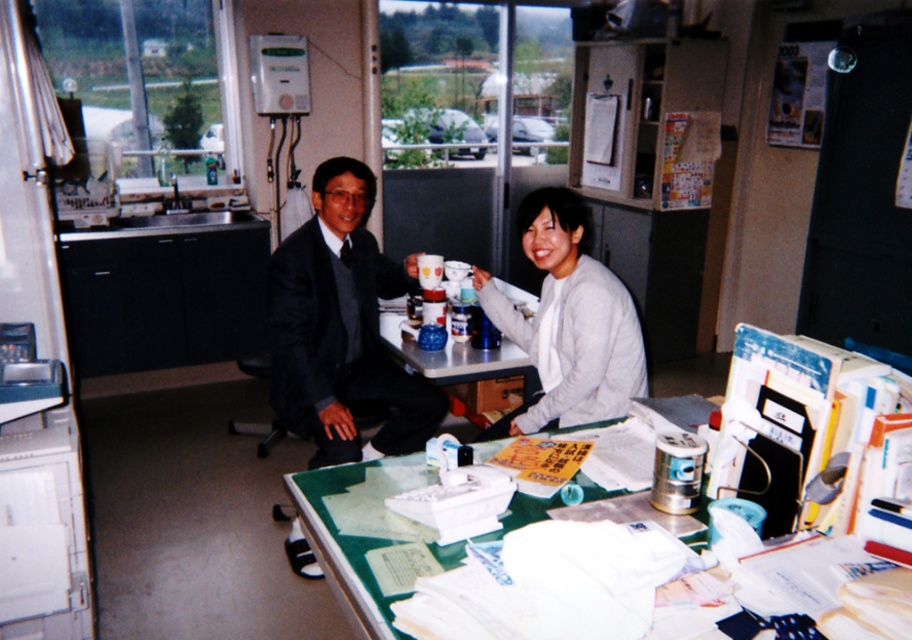
Does light gray sweater at center have a lesser height compared to green glass table at center?

Incorrect, light gray sweater at center's height does not fall short of green glass table at center's.

Consider the image. Which of these two, light gray sweater at center or green glass table at center, stands shorter?

With less height is green glass table at center.

Is point (566, 193) farther from viewer compared to point (395, 596)?

Yes, point (566, 193) is farther from viewer.

This screenshot has height=640, width=912. I want to click on light gray sweater at center, so click(x=567, y=323).

Can you confirm if matte black suit at center is taller than matte plastic table at center?

Yes.

Is matte black suit at center positioned at the back of matte plastic table at center?

That is False.

Is point (361, 312) farther from viewer compared to point (395, 339)?

No, (361, 312) is closer to viewer.

The width and height of the screenshot is (912, 640). I want to click on matte black suit at center, so click(342, 328).

This screenshot has width=912, height=640. In order to click on dark gray suit at center in this screenshot , I will do `click(342, 328)`.

Does point (358, 257) lie in front of point (338, 596)?

No.

This screenshot has width=912, height=640. In order to click on dark gray suit at center in this screenshot , I will do `click(342, 328)`.

Locate an element on the screen. Image resolution: width=912 pixels, height=640 pixels. dark gray suit at center is located at coordinates (342, 328).